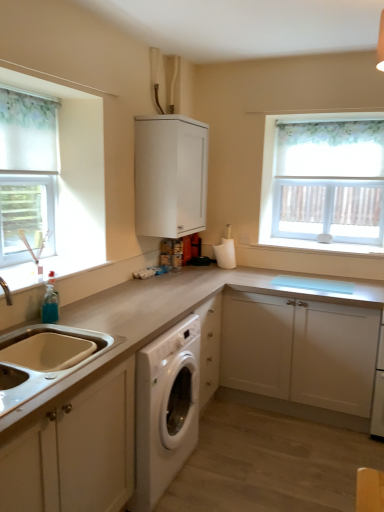
Locate an element on the screen. This screenshot has width=384, height=512. free space to the left of white matte toilet paper holder at center is located at coordinates (200, 270).